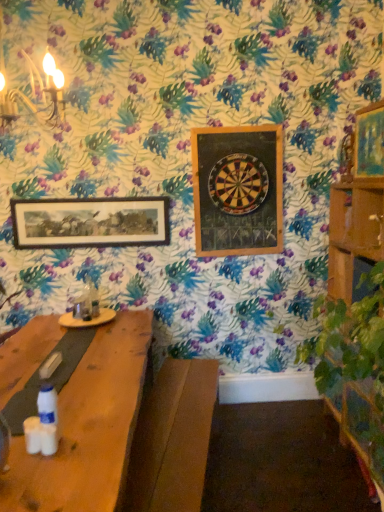
Locate an element on the screen. This screenshot has width=384, height=512. blank space situated above wooden dartboard at upper center, which is counted as the 2th picture frame, starting from the left (from a real-world perspective) is located at coordinates (236, 127).